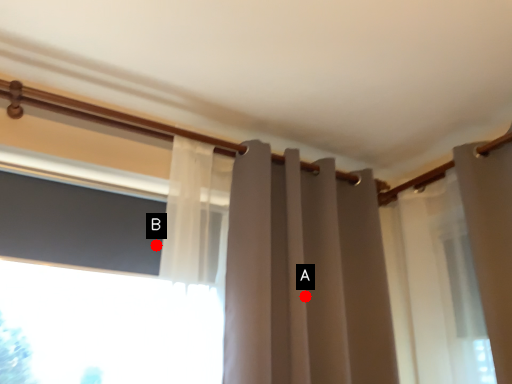
Question: Two points are circled on the image, labeled by A and B beside each circle. Which point is closer to the camera?

Choices:
 (A) A is closer
 (B) B is closer

Answer: (A)